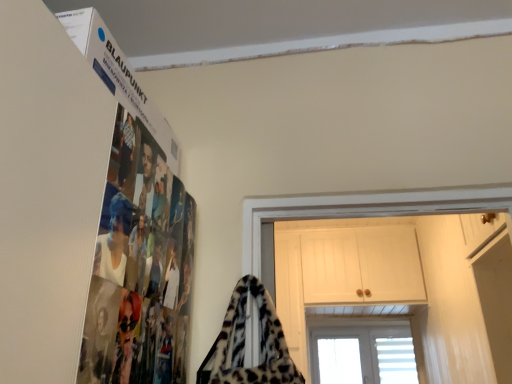
Locate an element on the screen. The width and height of the screenshot is (512, 384). leopard print fur at center is located at coordinates (244, 343).

Measure the distance between leopard print fur at center and camera.

leopard print fur at center and camera are 87.30 centimeters apart.

The width and height of the screenshot is (512, 384). Describe the element at coordinates (244, 343) in the screenshot. I see `leopard print fur at center` at that location.

Describe the element at coordinates (398, 287) in the screenshot. This screenshot has width=512, height=384. I see `white wood cabinet at upper center` at that location.

Identify the location of white wood cabinet at upper center. (398, 287).

Where is `leopard print fur at center`? This screenshot has height=384, width=512. leopard print fur at center is located at coordinates (244, 343).

Based on their positions, is leopard print fur at center located to the left or right of white wood cabinet at upper center?

leopard print fur at center is positioned on white wood cabinet at upper center's left side.

Between leopard print fur at center and white wood cabinet at upper center, which one is positioned behind?

white wood cabinet at upper center is behind.

Which is behind, point (239, 357) or point (498, 308)?

The point (498, 308) is more distant.

From the image's perspective, is leopard print fur at center above white wood cabinet at upper center?

Indeed, from the image's perspective, leopard print fur at center is shown above white wood cabinet at upper center.

From a real-world perspective, who is located higher, leopard print fur at center or white wood cabinet at upper center?

In real-world perspective, white wood cabinet at upper center is above.

In terms of width, does leopard print fur at center look wider or thinner when compared to white wood cabinet at upper center?

In the image, leopard print fur at center appears to be more narrow than white wood cabinet at upper center.

In terms of height, does leopard print fur at center look taller or shorter compared to white wood cabinet at upper center?

leopard print fur at center is shorter than white wood cabinet at upper center.

Does leopard print fur at center have a larger size compared to white wood cabinet at upper center?

Actually, leopard print fur at center might be smaller than white wood cabinet at upper center.

Can white wood cabinet at upper center be found inside leopard print fur at center?

No, white wood cabinet at upper center is not surrounded by leopard print fur at center.

Is leopard print fur at center not near white wood cabinet at upper center?

Yes, leopard print fur at center is far from white wood cabinet at upper center.

Is leopard print fur at center oriented towards white wood cabinet at upper center?

No.

How many degrees apart are the facing directions of leopard print fur at center and white wood cabinet at upper center?

They differ by 9.52 degrees in their facing directions.

Locate an element on the screen. The image size is (512, 384). blanket above the white wood cabinet at upper center (from the image's perspective) is located at coordinates (244, 343).

Is white wood cabinet at upper center to the left or to the right of leopard print fur at center in the image?

Clearly, white wood cabinet at upper center is on the right of leopard print fur at center in the image.

Is white wood cabinet at upper center in front of leopard print fur at center?

No, white wood cabinet at upper center is further to the viewer.

Which is closer, [408,241] or [265,322]?

Clearly, point [408,241] is more distant from the camera than point [265,322].

In the scene shown: From the image's perspective, is white wood cabinet at upper center under leopard print fur at center?

Correct, white wood cabinet at upper center appears lower than leopard print fur at center in the image.

From a real-world perspective, is white wood cabinet at upper center located higher than leopard print fur at center?

Yes.

Considering the sizes of objects white wood cabinet at upper center and leopard print fur at center in the image provided, who is wider, white wood cabinet at upper center or leopard print fur at center?

white wood cabinet at upper center.

Consider the image. Does white wood cabinet at upper center have a greater height compared to leopard print fur at center?

Yes.

Does white wood cabinet at upper center have a smaller size compared to leopard print fur at center?

Actually, white wood cabinet at upper center might be larger than leopard print fur at center.

Is leopard print fur at center completely or partially inside white wood cabinet at upper center?

Definitely not — leopard print fur at center is not inside white wood cabinet at upper center.

Looking at this image, is white wood cabinet at upper center far from leopard print fur at center?

Yes.

Is leopard print fur at center at the back of white wood cabinet at upper center?

No, white wood cabinet at upper center's orientation is not away from leopard print fur at center.

Where is `blanket above the white wood cabinet at upper center (from the image's perspective)`? This screenshot has width=512, height=384. blanket above the white wood cabinet at upper center (from the image's perspective) is located at coordinates (244, 343).

In order to click on dresser above the leopard print fur at center (from a real-world perspective) in this screenshot , I will do `click(398, 287)`.

Locate an element on the screen. Image resolution: width=512 pixels, height=384 pixels. blanket in front of the white wood cabinet at upper center is located at coordinates (244, 343).